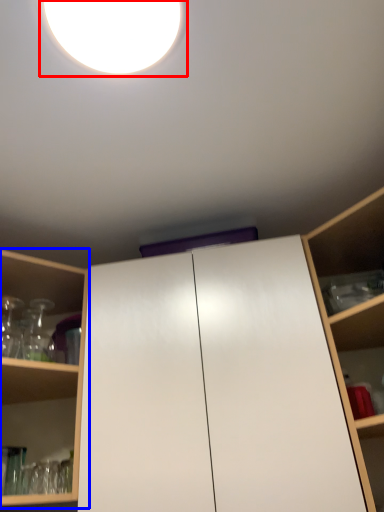
Question: Which of the following is the farthest to the observer, droplight (highlighted by a red box) or shelf (highlighted by a blue box)?

Choices:
 (A) droplight
 (B) shelf

Answer: (B)